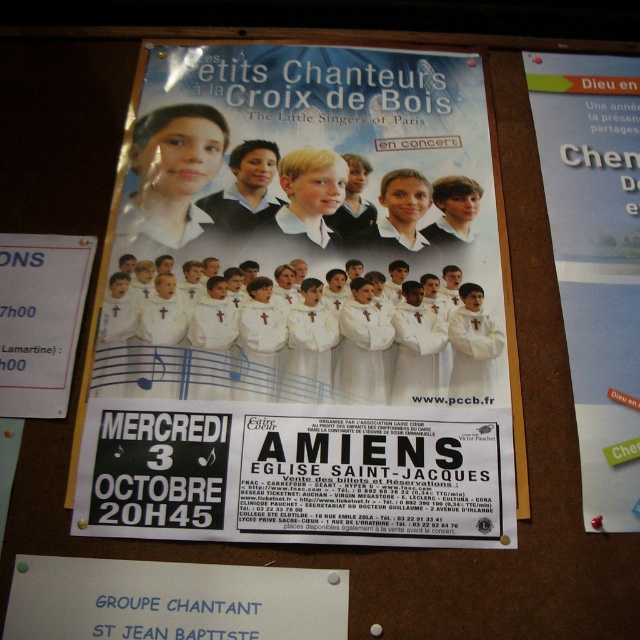
You are organizing a school event and need to hang two items on the bulletin board. You have a white paper poster at center and a white paper at upper right. Which one should you hang higher up if you want the taller item to be at the top?

The white paper poster at center is taller than the white paper at upper right, so you should hang the white paper poster at center higher up to place the taller item at the top.

You are organizing a school event and need to display two notices. You have a white paper poster at center and a white paper at upper right. Which one can you use to display more detailed information because of its size?

The white paper poster at center has a larger size compared to the white paper at upper right, so it can display more detailed information.

You are organizing a school event and need to hang two items on the bulletin board. You have a white paper poster at center and a white paper at upper right. According to the current arrangement, which item is located to the left of the other?

The white paper poster at center is positioned on the left side of white paper at upper right.